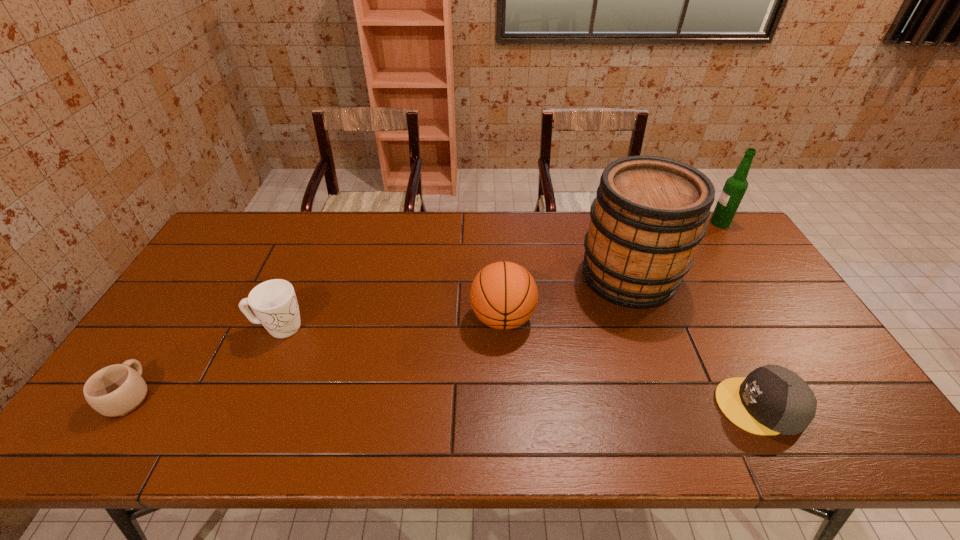
Find the location of a particular element. free region located on the front of the cider is located at coordinates (688, 441).

At what (x,y) coordinates should I click in order to perform the action: click on vacant space located 0.150m on the label of the farthest object. Please return your answer as a coordinate pair (x, y). Looking at the image, I should click on (669, 222).

I want to click on vacant space situated on the label of the farthest object, so click(x=605, y=222).

The image size is (960, 540). Identify the location of vacant space located 0.270m on the label of the farthest object. (636, 222).

This screenshot has width=960, height=540. Identify the location of free region located on the left of the basketball. (425, 318).

The image size is (960, 540). I want to click on vacant space located 0.110m on the side of the right mug with the handle, so click(345, 327).

Where is `free spot located 0.330m on the front-facing side of the cap`? This screenshot has height=540, width=960. free spot located 0.330m on the front-facing side of the cap is located at coordinates (580, 406).

This screenshot has width=960, height=540. Find the location of `free region located 0.070m on the front-facing side of the cap`. free region located 0.070m on the front-facing side of the cap is located at coordinates (688, 406).

Locate an element on the screen. This screenshot has height=540, width=960. vacant region located on the front-facing side of the cap is located at coordinates (667, 406).

This screenshot has width=960, height=540. What are the coordinates of `free space located on the side of the nearer mug with the handle` in the screenshot? It's located at (165, 341).